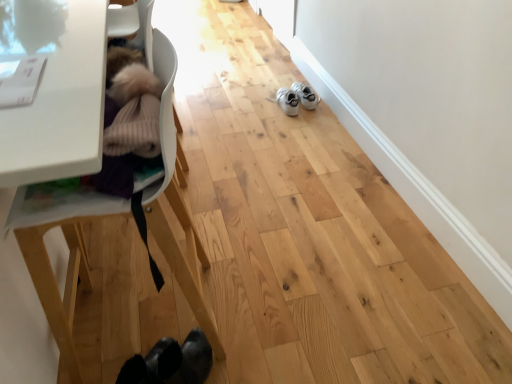
Question: Can you confirm if white suede shoes at center is positioned to the right of white plastic baby carriage at left?

Choices:
 (A) no
 (B) yes

Answer: (B)

Question: Considering the relative sizes of white suede shoes at center and white plastic baby carriage at left in the image provided, is white suede shoes at center bigger than white plastic baby carriage at left?

Choices:
 (A) no
 (B) yes

Answer: (A)

Question: From a real-world perspective, is white suede shoes at center physically below white plastic baby carriage at left?

Choices:
 (A) yes
 (B) no

Answer: (A)

Question: From the image's perspective, is white suede shoes at center over white plastic baby carriage at left?

Choices:
 (A) yes
 (B) no

Answer: (A)

Question: Considering the relative positions of white suede shoes at center and white plastic baby carriage at left in the image provided, is white suede shoes at center in front of white plastic baby carriage at left?

Choices:
 (A) yes
 (B) no

Answer: (B)

Question: Can you see white suede shoes at center touching white plastic baby carriage at left?

Choices:
 (A) yes
 (B) no

Answer: (B)

Question: From the image's perspective, does white plastic baby carriage at left appear lower than white suede shoes at center?

Choices:
 (A) yes
 (B) no

Answer: (A)

Question: Is white plastic baby carriage at left taller than white suede shoes at center?

Choices:
 (A) yes
 (B) no

Answer: (A)

Question: Is white plastic baby carriage at left positioned behind white suede shoes at center?

Choices:
 (A) no
 (B) yes

Answer: (A)

Question: Considering the relative positions of white plastic baby carriage at left and white suede shoes at center in the image provided, is white plastic baby carriage at left to the left of white suede shoes at center from the viewer's perspective?

Choices:
 (A) no
 (B) yes

Answer: (B)

Question: Does white plastic baby carriage at left appear on the right side of white suede shoes at center?

Choices:
 (A) yes
 (B) no

Answer: (B)

Question: From a real-world perspective, is white plastic baby carriage at left positioned over white suede shoes at center based on gravity?

Choices:
 (A) yes
 (B) no

Answer: (A)

Question: From the image's perspective, is white plastic baby carriage at left above or below white suede shoes at center?

Choices:
 (A) below
 (B) above

Answer: (A)